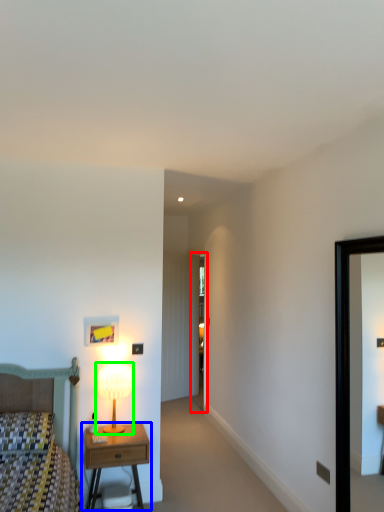
Question: Considering the real-world distances, which object is farthest from glass door (highlighted by a red box)? nightstand (highlighted by a blue box) or table lamp (highlighted by a green box)?

Choices:
 (A) nightstand
 (B) table lamp

Answer: (A)